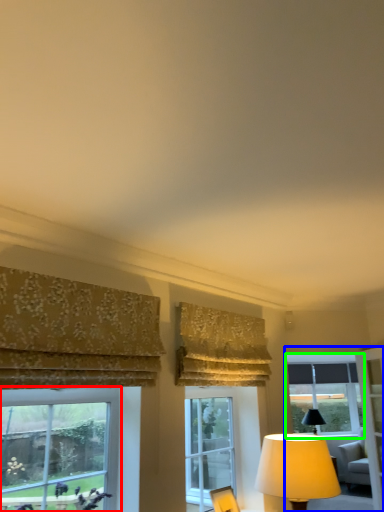
Question: Which is nearer to the window (highlighted by a red box)? window frame (highlighted by a blue box) or window (highlighted by a green box).

Choices:
 (A) window frame
 (B) window

Answer: (A)